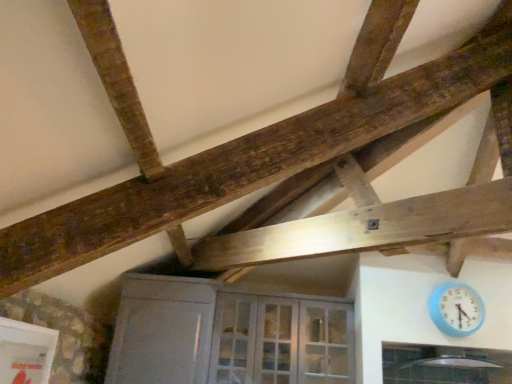
Question: Considering the positions of point (329, 311) and point (507, 377), is point (329, 311) closer or farther from the camera than point (507, 377)?

Choices:
 (A) farther
 (B) closer

Answer: (A)

Question: Do you think white glass door at center is within clear glass window at lower center, or outside of it?

Choices:
 (A) outside
 (B) inside

Answer: (A)

Question: Based on their relative distances, which object is nearer to the white glass door at center?

Choices:
 (A) clear glass window at lower center
 (B) blue plastic wall clock at lower right

Answer: (A)

Question: Considering the real-world distances, which object is farthest from the white glass door at center?

Choices:
 (A) clear glass window at lower center
 (B) blue plastic wall clock at lower right

Answer: (B)